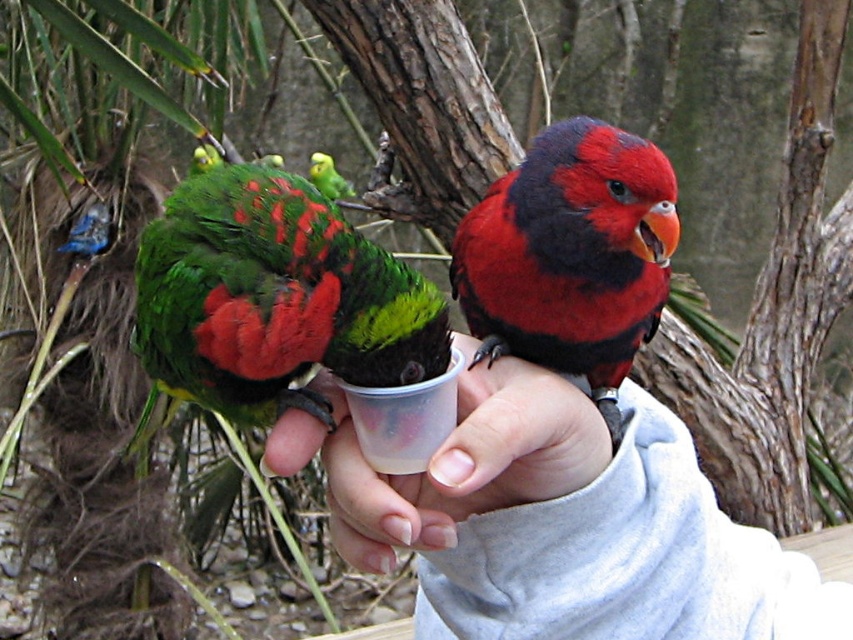
Question: Does smooth plastic cup at center have a lesser width compared to green glossy parrot at upper center?

Choices:
 (A) yes
 (B) no

Answer: (B)

Question: Which point is farther to the camera?

Choices:
 (A) (276, 160)
 (B) (500, 339)

Answer: (A)

Question: Among these objects, which one is farthest from the camera?

Choices:
 (A) green glossy parrot at upper center
 (B) green matte parrot at center
 (C) smooth plastic cup at center

Answer: (A)

Question: Where is green matte parrot at center located in relation to clear plastic cup at center in the image?

Choices:
 (A) right
 (B) left

Answer: (B)

Question: Can you confirm if shiny red parrot at center is bigger than clear plastic cup at center?

Choices:
 (A) no
 (B) yes

Answer: (B)

Question: Which point is closer to the camera?

Choices:
 (A) smooth plastic cup at center
 (B) green matte parrot at center
 (C) green glossy parrot at upper center

Answer: (A)